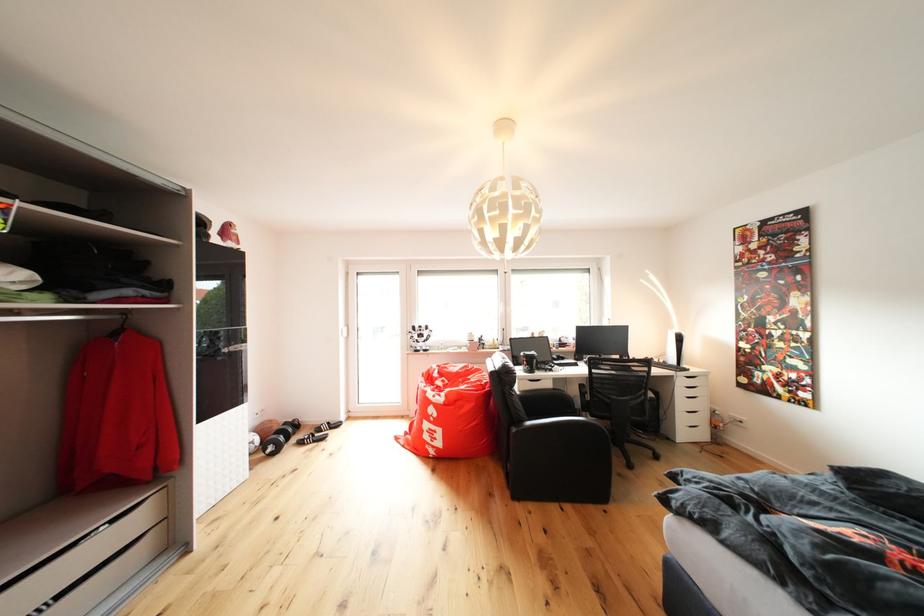
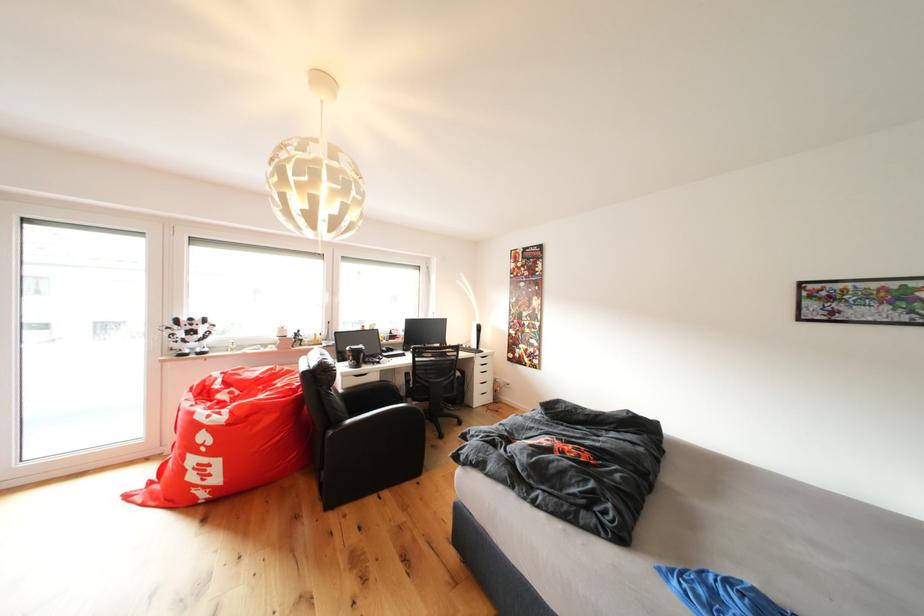
Locate, in the second image, the point that corresponds to the point at 429,331 in the first image.

(200, 323)